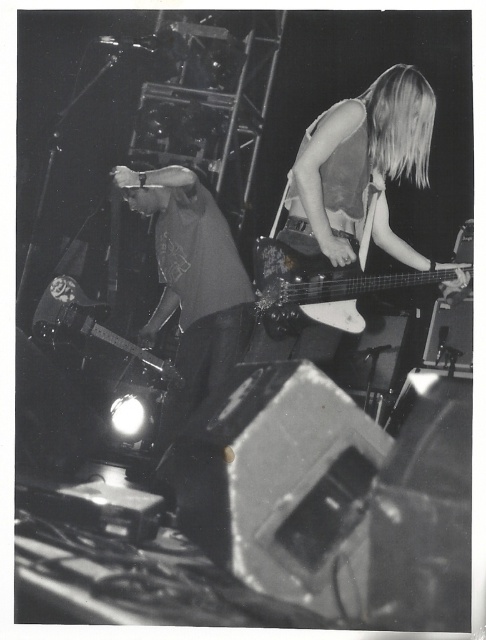
You are a photographer standing in the audience, and you want to capture a closeup shot of both the shiny silver guitar at upper right and the dark gray fabric shirt at center. Given that your camera has a maximum focus range of 24 inches, can you fit both subjects into the same frame without moving closer?

The shiny silver guitar at upper right and dark gray fabric shirt at center are 24.02 inches apart from each other. Since the distance between them exceeds the camera maximum focus range of 24 inches, you cannot fit both subjects into the same frame without moving closer.

You are a photographer in the audience and want to capture a closeup of both the glossy black guitar at center and the shiny black electric guitar at left. Since you have a wide angle lens, which guitar should you focus on first to ensure both are in frame?

The glossy black guitar at center is to the right of the shiny black electric guitar at left, so you should focus on the shiny black electric guitar at left first to ensure both are in frame.

You are a photographer adjusting lighting for the image. You need to ensure that the shiny silver guitar at upper right and the dark gray fabric shirt at center are both well illuminated. Given their sizes, which object requires a wider light source to cover its entire surface?

The shiny silver guitar at upper right requires a wider light source because its width is larger than the dark gray fabric shirt at center.